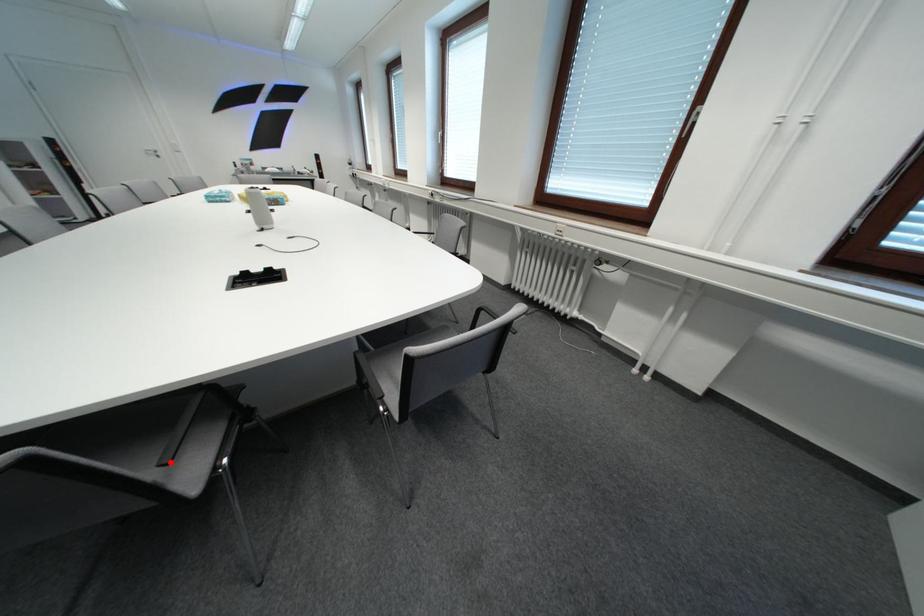
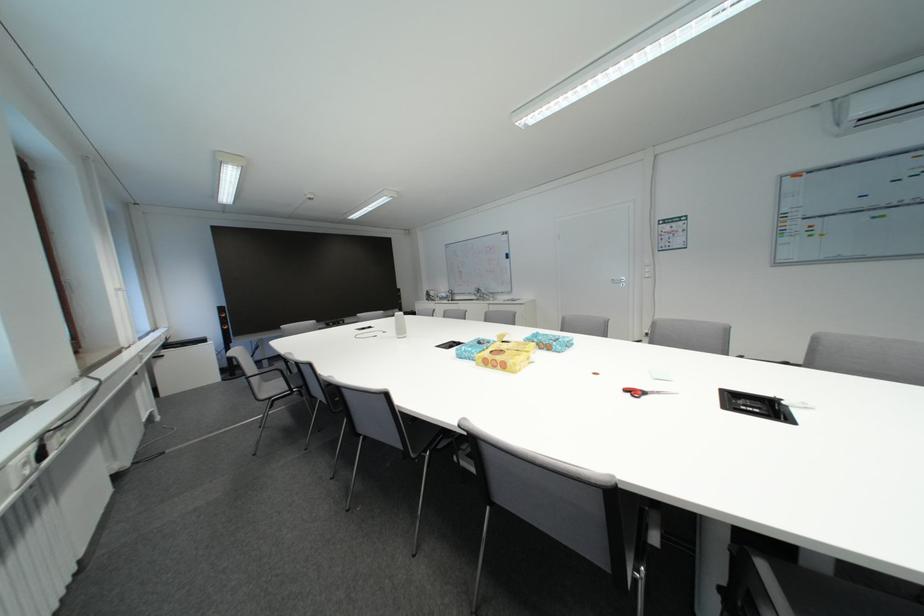
Question: I am providing you with two images of the same scene from different viewpoints. A red point is marked on the first image. At the location where the point appears in image 1, is it still visible in image 2?

Choices:
 (A) Yes
 (B) No

Answer: (B)